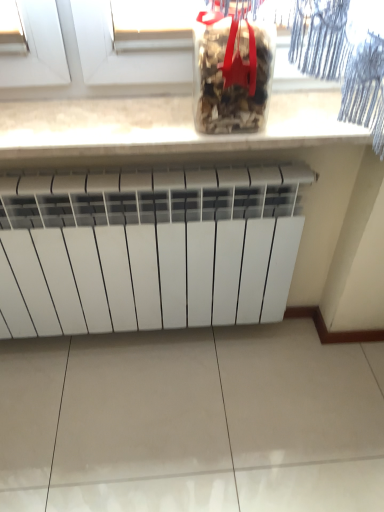
Where is `free space above white matte radiator at center (from a real-world perspective)`? free space above white matte radiator at center (from a real-world perspective) is located at coordinates (103, 177).